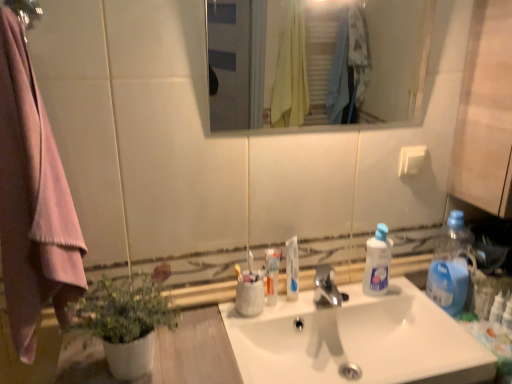
You are a GUI agent. You are given a task and a screenshot of the screen. Output one action in this format:
    pyautogui.click(x=<x>, y=<y>)
    Task: Click on the vacant space in between green matte plant at lower left and white glossy toothpaste at center, which ranks as the second toothpaste in right-to-left order
    This screenshot has height=384, width=512.
    Given the screenshot: What is the action you would take?
    pyautogui.click(x=214, y=340)